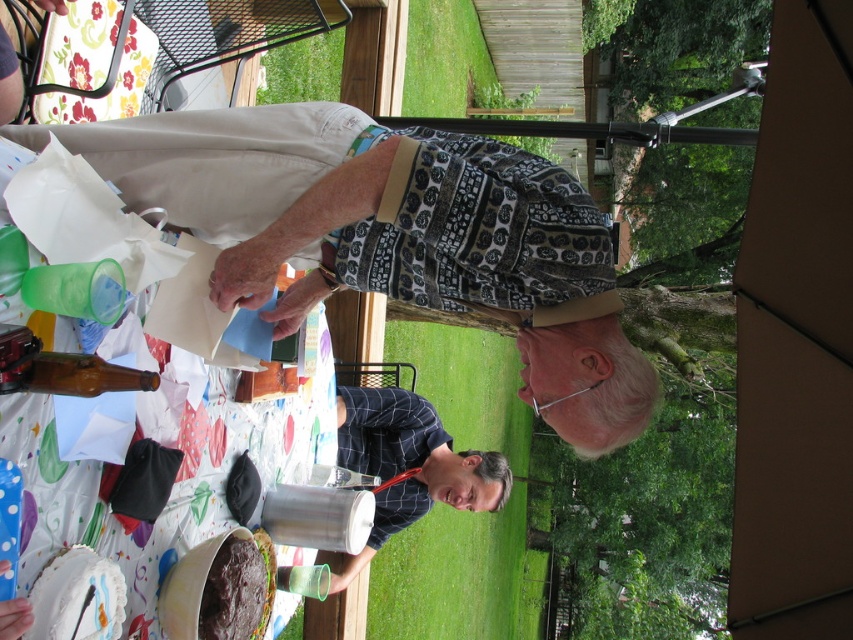
You are a guest at this outdoor gathering and want to know if the brown fabric canopy at upper right can provide shade over the dark blue plaid shirt at center. Based on their heights, can it cover the shirt?

The brown fabric canopy at upper right is taller than the dark blue plaid shirt at center, so it has the potential to provide shade over the shirt depending on its positioning and angle.

You are at a backyard party and want to take a photo of the brown fabric canopy at upper right using a camera that has a 10 feet maximum reach. Can you reach the canopy from your current position with the camera?

The brown fabric canopy at upper right and camera are 9.88 feet apart, so yes, the camera can reach the canopy since the distance is within its 10 feet maximum reach.